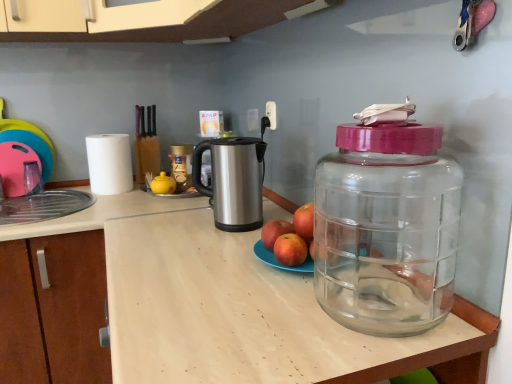
Locate an element on the screen. The width and height of the screenshot is (512, 384). empty space that is ontop of transparent wood counter top at center, positioned as the second counter top in back-to-front order (from a real-world perspective) is located at coordinates (196, 246).